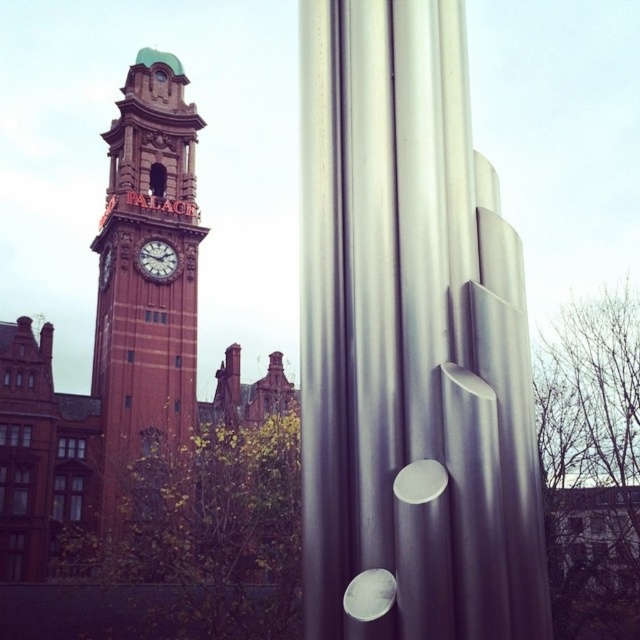
You are an architect visiting the city and want to compare the sizes of the red brick clock tower at left and the matte red clock at center. Based on the scene, which object is larger?

The red brick clock tower at left is bigger than the matte red clock at center, so the red brick clock tower at left is larger.

You are standing in front of the clock tower and the modern sculpture. There is a point at coordinates point (164, 148). If you want to reach this point as quickly as possible, which direction should you move towards?

The point (164, 148) is 307.07 feet away from the camera, so you should move towards the direction of the point to reach it as quickly as possible.